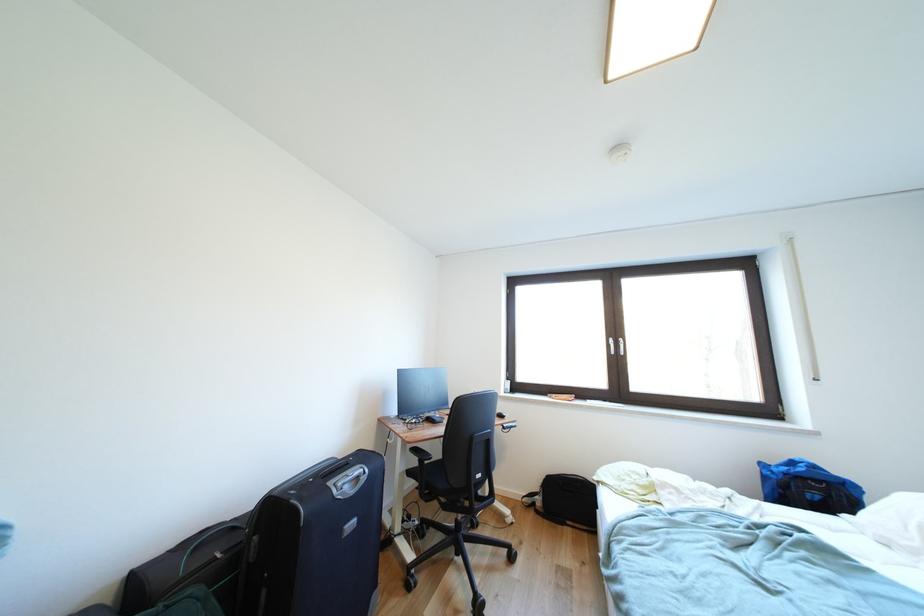
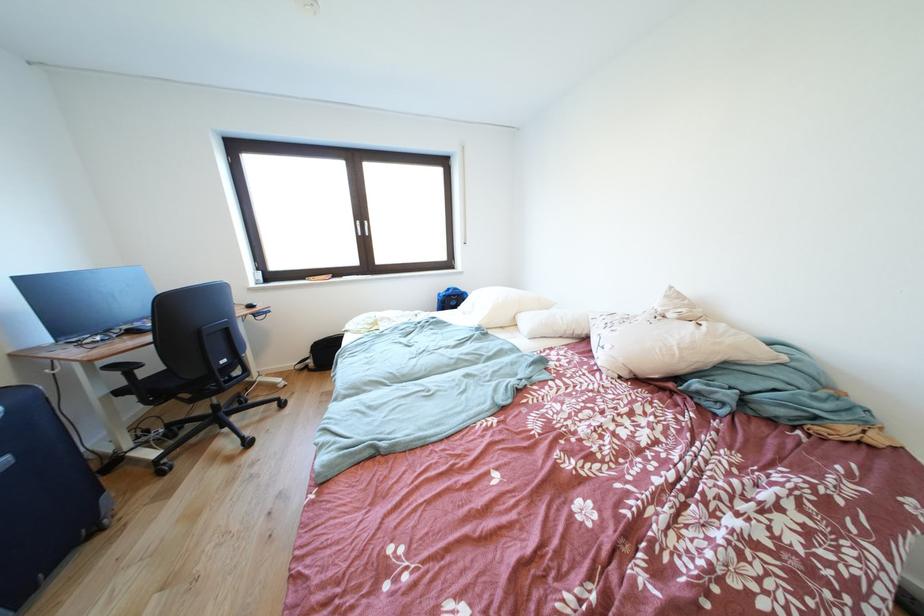
Where in the second image is the point corresponding to point (619, 345) from the first image?

(367, 228)